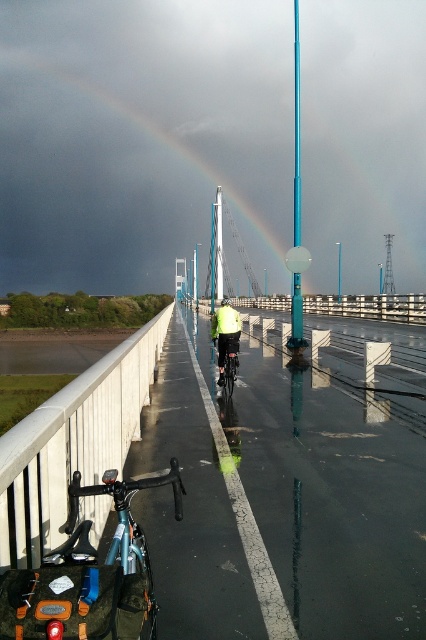
From the picture: Is shiny metallic bicycle at lower left closer to the viewer compared to blue glossy pole at center?

Yes, it is in front of blue glossy pole at center.

Between shiny metallic bicycle at lower left and blue glossy pole at center, which one has less height?

With less height is shiny metallic bicycle at lower left.

Is point (100, 572) positioned after point (339, 282)?

No, it is in front of (339, 282).

This screenshot has height=640, width=426. I want to click on shiny metallic bicycle at lower left, so click(89, 573).

Can you confirm if shiny metallic bicycle at lower left is smaller than teal glossy pole at center?

Indeed, shiny metallic bicycle at lower left has a smaller size compared to teal glossy pole at center.

Which is below, shiny metallic bicycle at lower left or teal glossy pole at center?

shiny metallic bicycle at lower left

Is point (19, 632) farther from viewer compared to point (296, 61)?

No, it is not.

The width and height of the screenshot is (426, 640). Identify the location of shiny metallic bicycle at lower left. tap(89, 573).

Who is shorter, shiny metallic bicycle at center or blue glossy pole at center?

With less height is shiny metallic bicycle at center.

Measure the distance between shiny metallic bicycle at center and camera.

The distance of shiny metallic bicycle at center from camera is 11.85 meters.

Find the location of `shiny metallic bicycle at center`. shiny metallic bicycle at center is located at coordinates (227, 362).